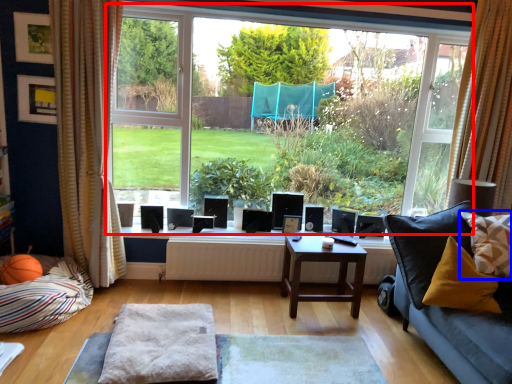
Question: Which of the following is the closest to the observer, window (highlighted by a red box) or pillow (highlighted by a blue box)?

Choices:
 (A) window
 (B) pillow

Answer: (B)